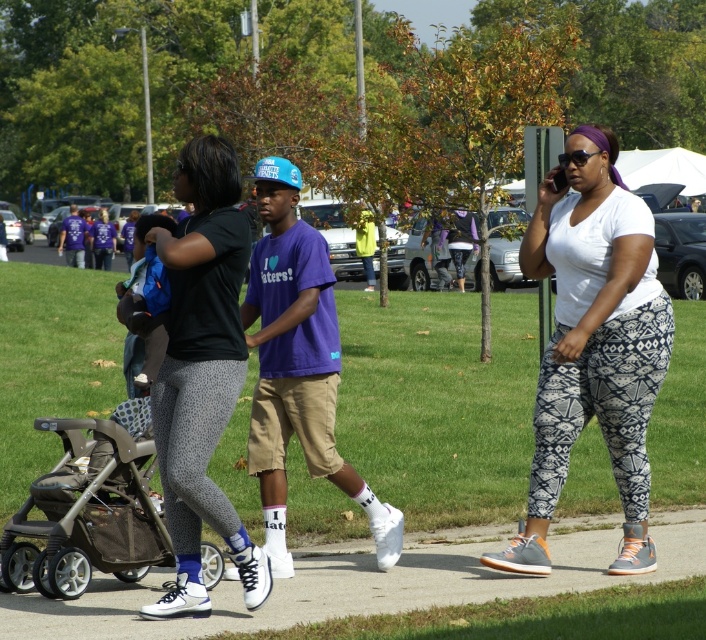
You are a photographer at the event and want to capture a photo of both the white printed leggings at center and the matte black leggings at center. Which leggings should you focus on first if you want to include both in the frame without moving the camera?

The white printed leggings at center is positioned on the right side of matte black leggings at center, so you should focus on the matte black leggings at center first to ensure both are in the frame without moving the camera.

You are standing at the park and want to walk to the white concrete sidewalk at center. Which direction should you go?

The white concrete sidewalk at center is located at point (369,580), so you should walk towards the center of the image to reach it.

You are a photographer standing at the center of the scene. You want to take a photo that includes both the point at coordinates point (209, 305) and point (138, 451). Which point should you focus on first to ensure both are in sharp focus?

You should focus on point (209, 305) first because it is closer to the camera than point (138, 451). By focusing on the closer point, the farther point will also be within the depth of field and in focus.